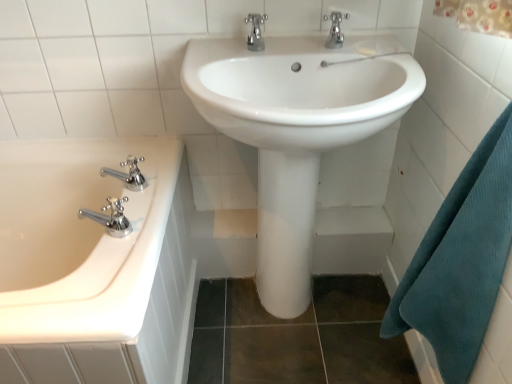
Question: Considering the relative positions of white glossy sink at center and chrome metallic faucet at upper center, arranged as the 2th tap when viewed from the top, in the image provided, is white glossy sink at center in front of chrome metallic faucet at upper center, arranged as the 2th tap when viewed from the top,?

Choices:
 (A) no
 (B) yes

Answer: (B)

Question: From the image's perspective, is white glossy sink at center on chrome metallic faucet at upper center, acting as the third tap starting from the left?

Choices:
 (A) yes
 (B) no

Answer: (B)

Question: From a real-world perspective, is white glossy sink at center located higher than chrome metallic faucet at upper center, arranged as the 2th tap when viewed from the top?

Choices:
 (A) no
 (B) yes

Answer: (A)

Question: Is white glossy sink at center positioned beyond the bounds of chrome metallic faucet at upper center, acting as the third tap starting from the left?

Choices:
 (A) yes
 (B) no

Answer: (A)

Question: Is white glossy sink at center taller than chrome metallic faucet at upper center, arranged as the 2th tap when viewed from the top?

Choices:
 (A) no
 (B) yes

Answer: (B)

Question: Visually, is chrome/metallic faucet at left, acting as the 2th tap starting from the left, positioned to the left or to the right of white glossy sink at center?

Choices:
 (A) left
 (B) right

Answer: (A)

Question: Considering the positions of point (114, 231) and point (279, 44), is point (114, 231) closer or farther from the camera than point (279, 44)?

Choices:
 (A) farther
 (B) closer

Answer: (B)

Question: Looking at the image, does chrome/metallic faucet at left, the 1th tap from the bottom, seem bigger or smaller compared to white glossy sink at center?

Choices:
 (A) small
 (B) big

Answer: (A)

Question: From the image's perspective, relative to white glossy sink at center, is chrome/metallic faucet at left, acting as the 2th tap starting from the left, above or below?

Choices:
 (A) above
 (B) below

Answer: (A)

Question: Does point (335, 36) appear closer or farther from the camera than point (304, 99)?

Choices:
 (A) farther
 (B) closer

Answer: (A)

Question: From the image's perspective, is chrome metallic faucet at upper center, which appears as the 4th tap when viewed from the left, positioned above or below white glossy sink at center?

Choices:
 (A) below
 (B) above

Answer: (B)

Question: From a real-world perspective, is chrome metallic faucet at upper center, the first tap in the top-to-bottom sequence, positioned above or below white glossy sink at center?

Choices:
 (A) below
 (B) above

Answer: (B)

Question: Is chrome metallic faucet at upper center, which is counted as the fourth tap, starting from the bottom, in front of or behind white glossy sink at center in the image?

Choices:
 (A) behind
 (B) front

Answer: (A)

Question: From a real-world perspective, is teal waffle towel at right physically located above or below chrome metallic faucet at left, the fourth tap from the right?

Choices:
 (A) below
 (B) above

Answer: (A)

Question: Considering the positions of teal waffle towel at right and chrome metallic faucet at left, arranged as the first tap when viewed from the left, in the image, is teal waffle towel at right taller or shorter than chrome metallic faucet at left, arranged as the first tap when viewed from the left,?

Choices:
 (A) tall
 (B) short

Answer: (A)